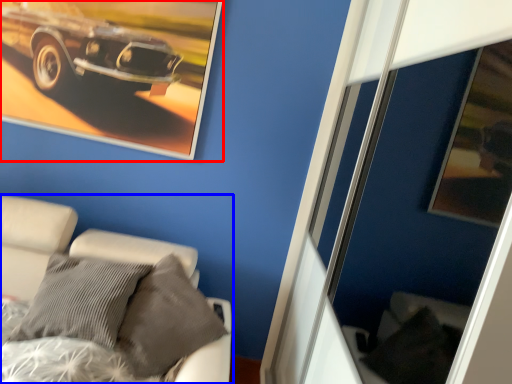
Question: Which object is further to the camera taking this photo, picture frame (highlighted by a red box) or furniture (highlighted by a blue box)?

Choices:
 (A) picture frame
 (B) furniture

Answer: (A)